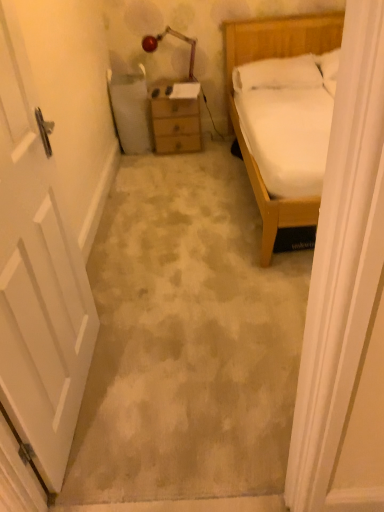
The image size is (384, 512). I want to click on free space to the back side of white matte door at left, so click(x=134, y=313).